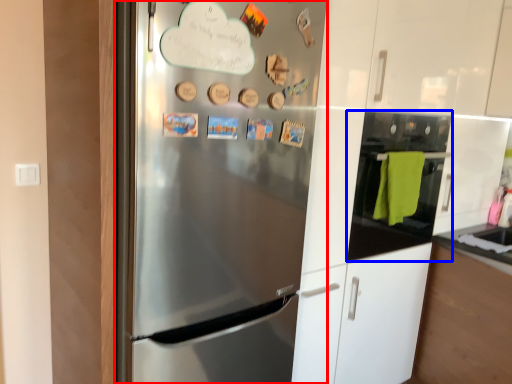
Question: Among these objects, which one is nearest to the camera, refrigerator (highlighted by a red box) or oven (highlighted by a blue box)?

Choices:
 (A) refrigerator
 (B) oven

Answer: (A)